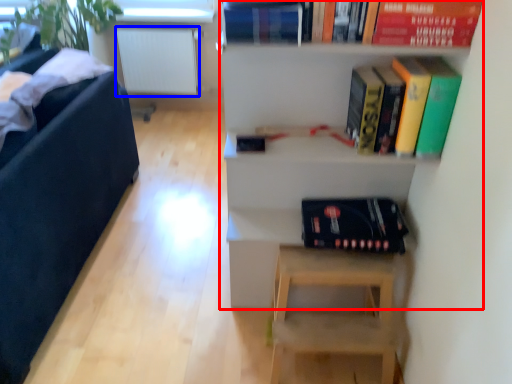
Question: Which point is further to the camera, shelf (highlighted by a red box) or radiator (highlighted by a blue box)?

Choices:
 (A) shelf
 (B) radiator

Answer: (B)